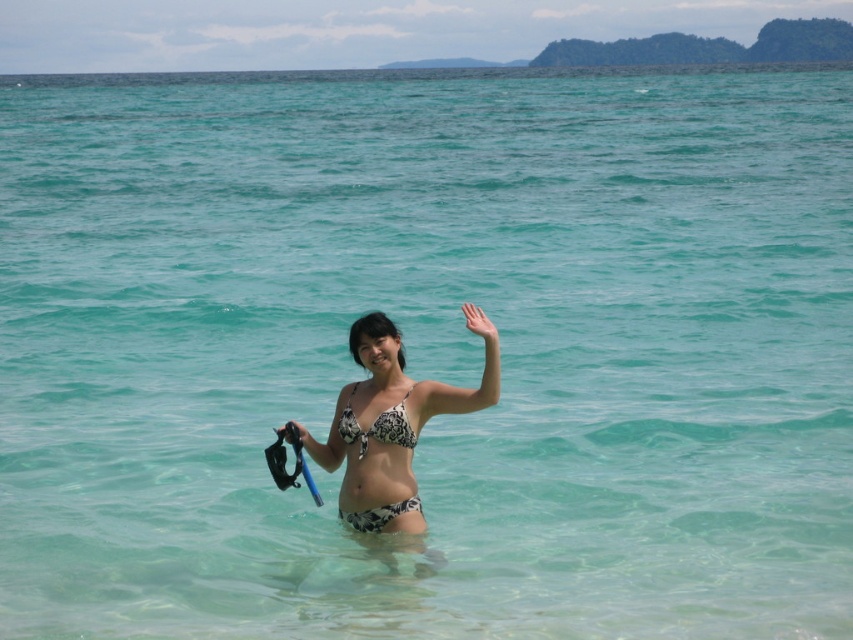
Who is lower down, white printed bikini at center or blue rubber paddle at center?

blue rubber paddle at center

This screenshot has width=853, height=640. Identify the location of white printed bikini at center. (392, 429).

Who is taller, black printed bikini at center or black rubber snorkel at center?

With more height is black printed bikini at center.

Which is in front, point (398, 416) or point (299, 440)?

Point (398, 416)

Image resolution: width=853 pixels, height=640 pixels. Find the location of `black printed bikini at center`. black printed bikini at center is located at coordinates (376, 426).

Is point (332, 428) more distant than point (300, 433)?

That is False.

What are the coordinates of `white printed bikini at center` in the screenshot? It's located at (392, 429).